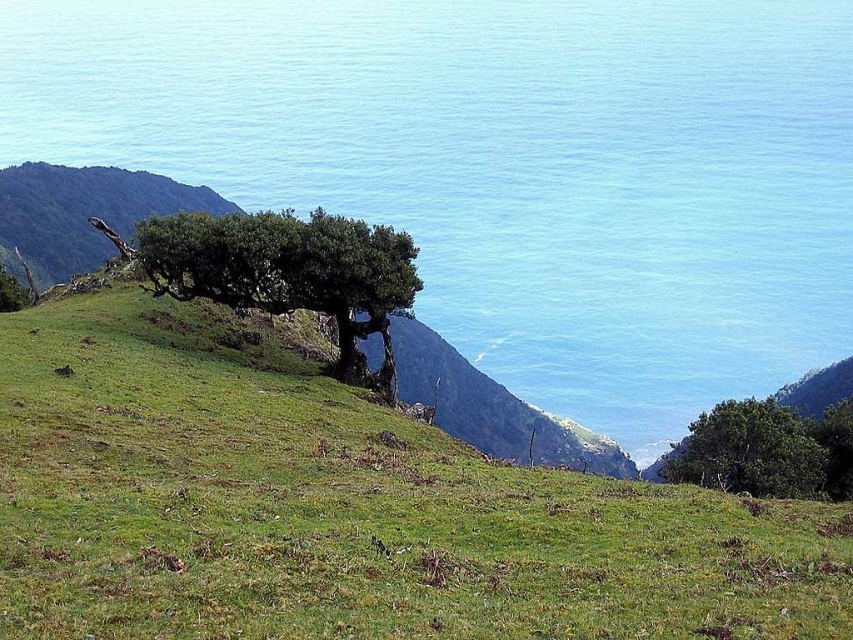
You are standing at the base of the solitary tree on the grassy hillside. Looking towards the point marked at coordinates [83,212], which direction should you face to see the green grassy hill at upper left?

The point at [83,212] indicates the green grassy hill at upper left, so you should face towards the upper left direction to see it.

You are standing at the base of the solitary tree on the grassy hillside. You see a point marked at coordinates (505, 166). Which direction should you walk to reach the blue water at upper center where the point is located?

The point at (505, 166) is on the blue water at upper center, so you should walk towards the upper center direction to reach it.